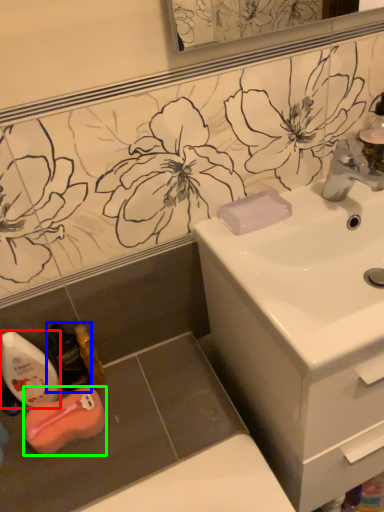
Question: Which is farther away from mouthwash (highlighted by a red box)? mouthwash (highlighted by a blue box) or chiffonier (highlighted by a green box)?

Choices:
 (A) mouthwash
 (B) chiffonier

Answer: (B)